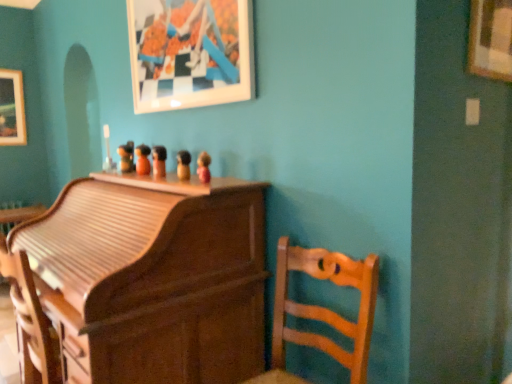
I want to click on free space to the left of wooden toy at center, arranged as the second toy when viewed from the back, so click(119, 175).